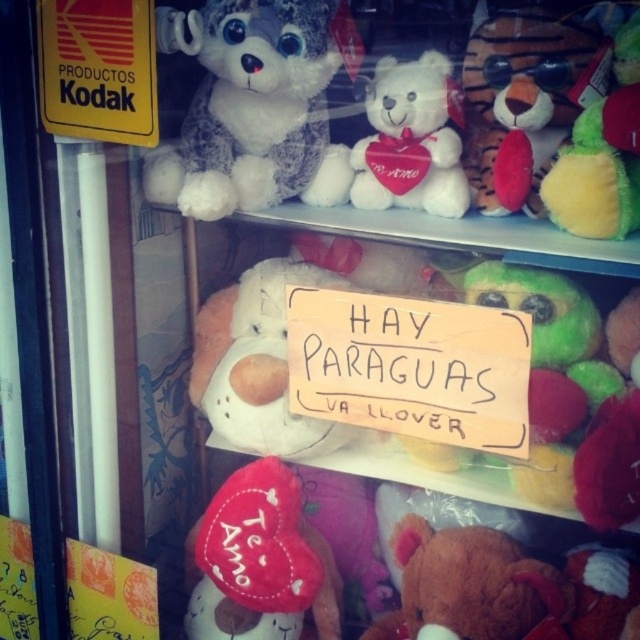
You are a customer in the store and want to take a photo of the white plush teddy bear at center with your camera. Can you fit both the teddy bear and the camera in the frame if the camera has a 30 inch wide field of view?

The white plush teddy bear at center and camera are 33.74 inches apart, which is wider than the camera field of view of 30 inches. Therefore, you cannot fit both the teddy bear and the camera in the frame.

Based on the scene description, where is the white plush teddy bear at center located in terms of its 2D coordinates?

The white plush teddy bear at center is located at the 2D coordinates of point (257, 364).